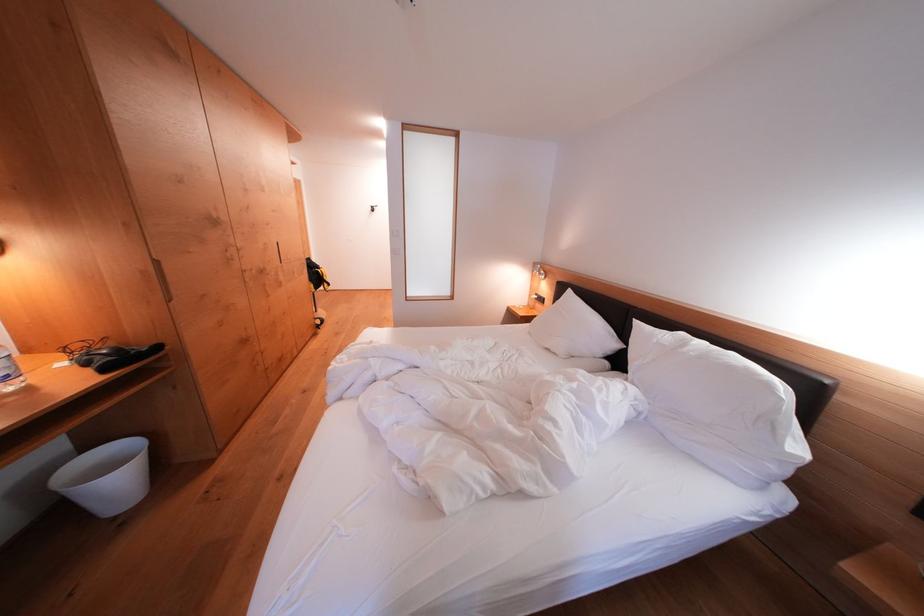
Identify the location of lamp head. (538, 270).